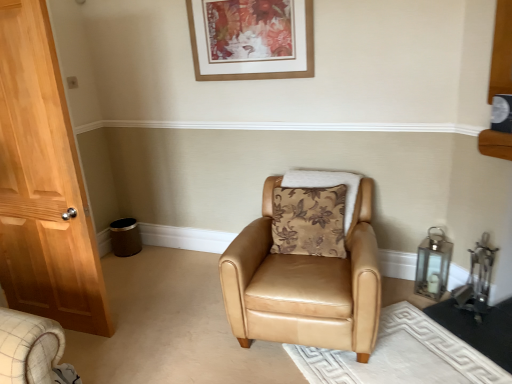
At what (x,y) coordinates should I click in order to perform the action: click on vacant space to the left of tan leather armchair at center. Please return your answer as a coordinate pair (x, y). The width and height of the screenshot is (512, 384). Looking at the image, I should click on (175, 315).